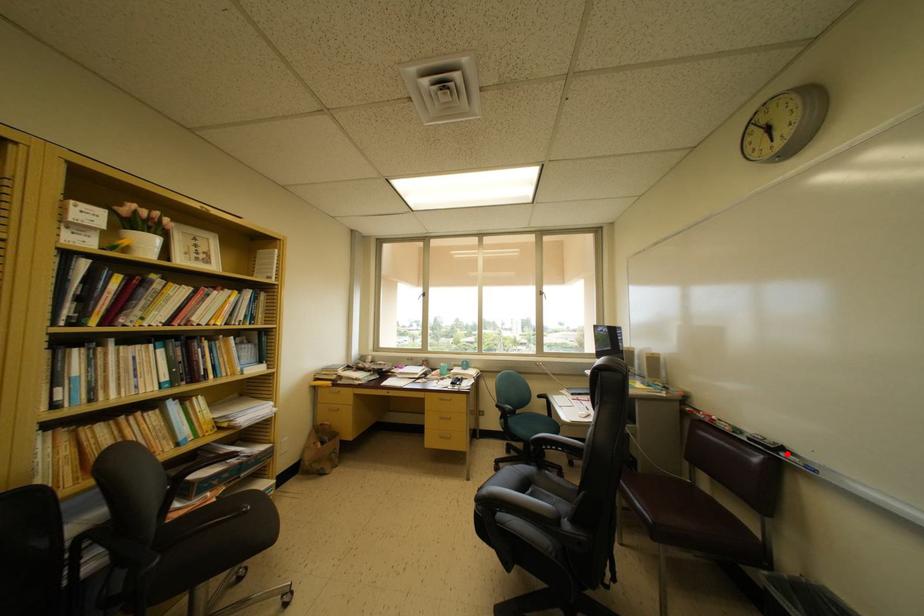
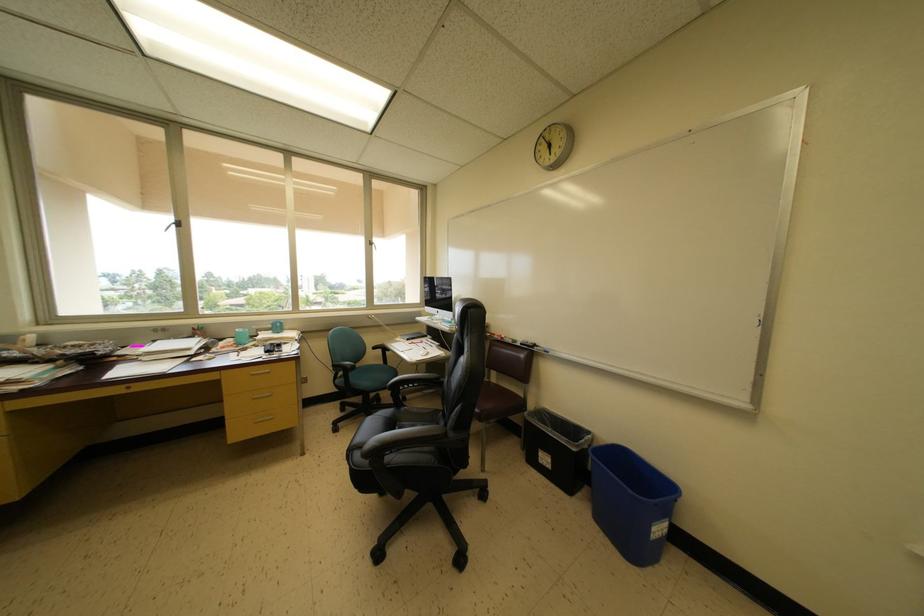
The point at the highlighted location is marked in the first image. Where is the corresponding point in the second image?

(539, 350)